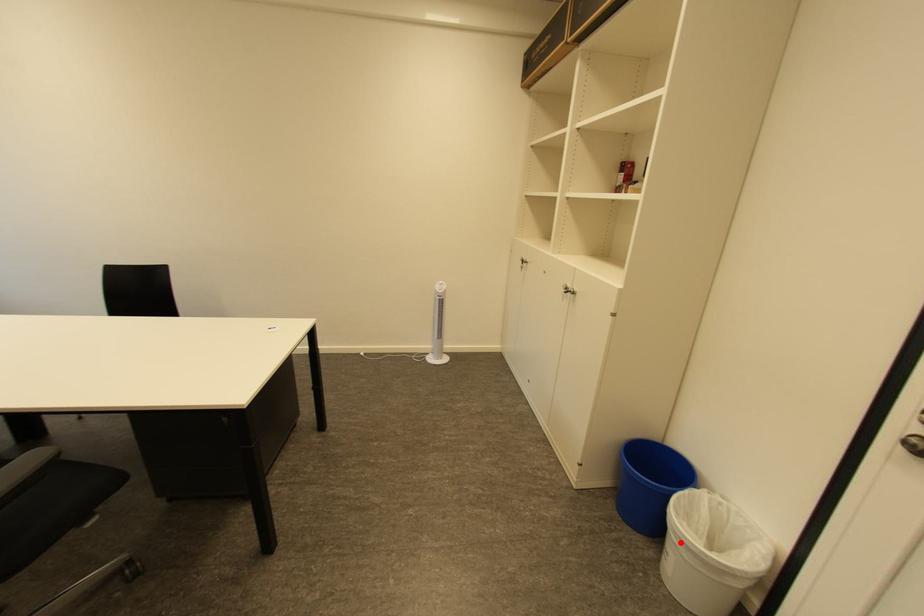
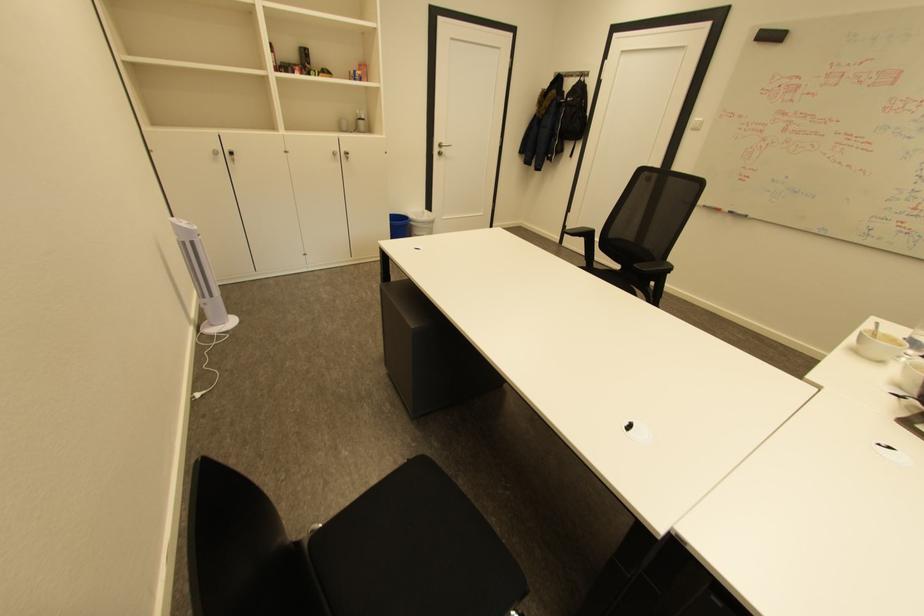
Where in the second image is the point corresponding to the highlighted location from the first image?

(432, 227)